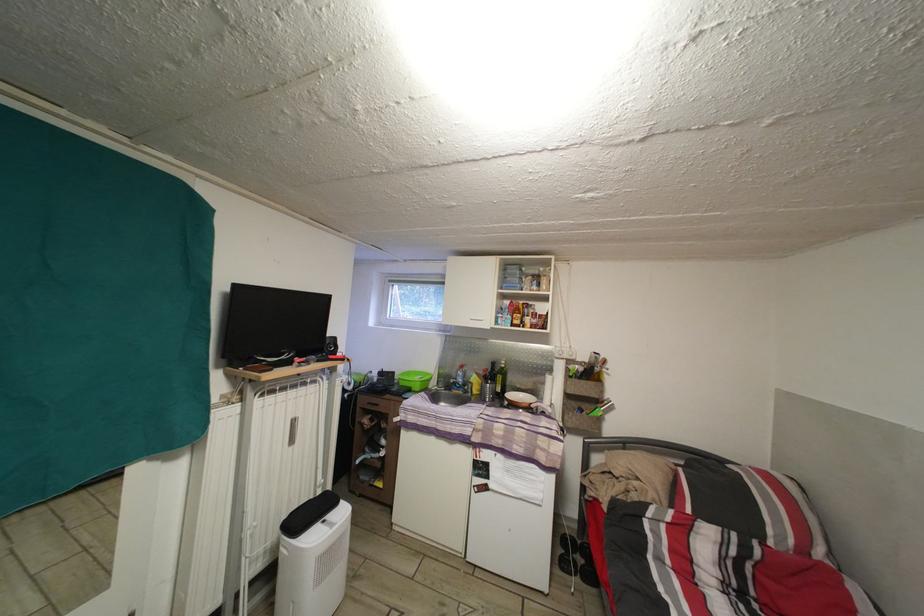
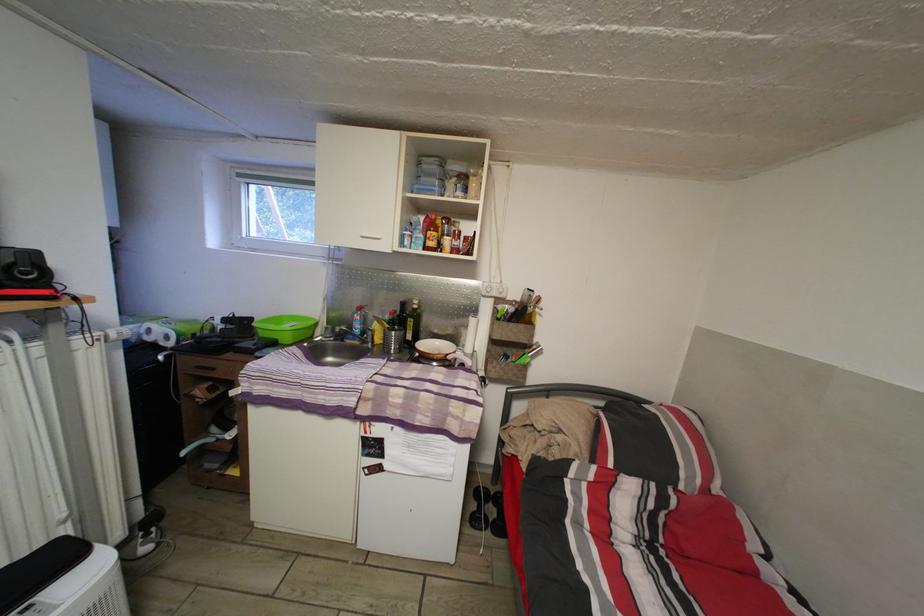
Looking at this image, the images are taken continuously from a first-person perspective. In which direction are you moving?

The movement direction of the cameraman is right, forward.